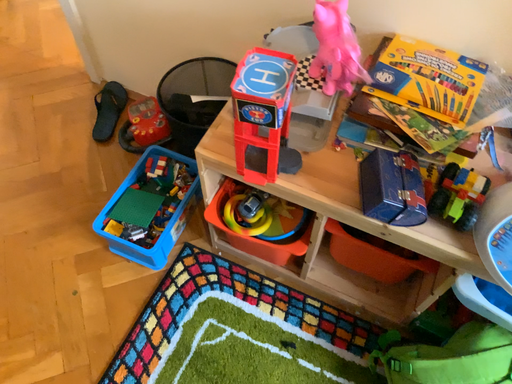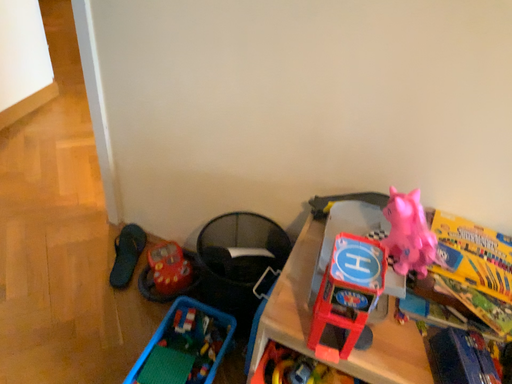
Question: How did the camera likely rotate when shooting the video?

Choices:
 (A) rotated upward
 (B) rotated downward

Answer: (A)